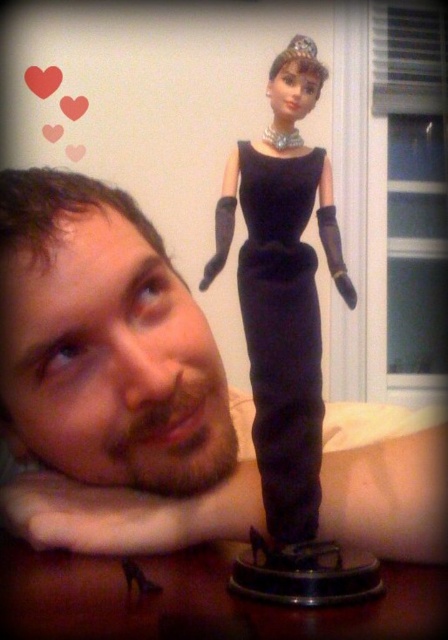
Question: Can you confirm if matte black doll at upper center is positioned below black velvet dress at center?

Choices:
 (A) no
 (B) yes

Answer: (B)

Question: Does matte black doll at upper center appear on the right side of matte black dress at center?

Choices:
 (A) no
 (B) yes

Answer: (A)

Question: Which object is the closest to the matte black dress at center?

Choices:
 (A) black velvet dress at center
 (B) silver metallic tiara at upper center

Answer: (A)

Question: Which point is farther from the camera taking this photo?

Choices:
 (A) (261, 422)
 (B) (203, 346)
 (C) (302, 44)

Answer: (C)

Question: Can you confirm if matte black doll at upper center is positioned to the right of silver metallic tiara at upper center?

Choices:
 (A) no
 (B) yes

Answer: (A)

Question: Which point appears farthest from the camera in this image?

Choices:
 (A) (141, 262)
 (B) (262, 330)
 (C) (280, 412)

Answer: (A)